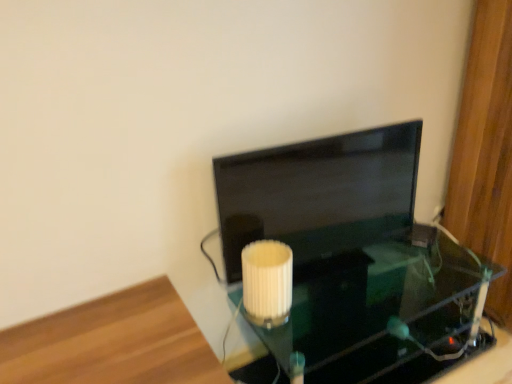
Where is `wooden floor at lower left`? Image resolution: width=512 pixels, height=384 pixels. wooden floor at lower left is located at coordinates (113, 342).

You are a GUI agent. You are given a task and a screenshot of the screen. Output one action in this format:
    pyautogui.click(x=<x>, y=<y>)
    Task: Click on the transparent glass table at center
    Image resolution: width=512 pixels, height=384 pixels.
    Given the screenshot: What is the action you would take?
    pyautogui.click(x=377, y=315)

Between white ribbed lampshade at center and matte black monitor at center, which one appears on the right side from the viewer's perspective?

From the viewer's perspective, matte black monitor at center appears more on the right side.

From the image's perspective, which is above, white ribbed lampshade at center or matte black monitor at center?

matte black monitor at center is shown above in the image.

In the image, there is a white ribbed lampshade at center. Where is `computer monitor above it (from the image's perspective)`? The image size is (512, 384). computer monitor above it (from the image's perspective) is located at coordinates (319, 193).

Could you tell me if white ribbed lampshade at center is turned towards matte black monitor at center?

No.

Between transparent glass table at center and matte black monitor at center, which one appears on the right side from the viewer's perspective?

From the viewer's perspective, transparent glass table at center appears more on the right side.

Which of these two, transparent glass table at center or matte black monitor at center, is bigger?

With larger size is transparent glass table at center.

From their relative heights in the image, would you say transparent glass table at center is taller or shorter than matte black monitor at center?

In the image, transparent glass table at center appears to be shorter than matte black monitor at center.

Is transparent glass table at center behind matte black monitor at center?

That is False.

Considering the sizes of objects matte black monitor at center and transparent glass table at center in the image provided, who is shorter, matte black monitor at center or transparent glass table at center?

transparent glass table at center is shorter.

Based on the photo, considering the relative positions of matte black monitor at center and transparent glass table at center in the image provided, is matte black monitor at center behind transparent glass table at center?

Yes, the depth of matte black monitor at center is greater than that of transparent glass table at center.

Is matte black monitor at center oriented away from transparent glass table at center?

No.

Considering the sizes of objects matte black monitor at center and transparent glass table at center in the image provided, who is wider, matte black monitor at center or transparent glass table at center?

Wider between the two is transparent glass table at center.

Is white ribbed lampshade at center surrounding wooden floor at lower left?

Actually, wooden floor at lower left is outside white ribbed lampshade at center.

From the image's perspective, which is above, white ribbed lampshade at center or wooden floor at lower left?

white ribbed lampshade at center is shown above in the image.

Is white ribbed lampshade at center thinner than wooden floor at lower left?

Yes, white ribbed lampshade at center is thinner than wooden floor at lower left.

Based on their sizes in the image, would you say transparent glass table at center is bigger or smaller than white ribbed lampshade at center?

transparent glass table at center is bigger than white ribbed lampshade at center.

Does transparent glass table at center come behind white ribbed lampshade at center?

No, the depth of transparent glass table at center is less than that of white ribbed lampshade at center.

The image size is (512, 384). I want to click on table below the white ribbed lampshade at center (from the image's perspective), so click(377, 315).

Which is less distant, (358,306) or (268,297)?

Point (358,306) appears to be farther away from the viewer than point (268,297).

How much distance is there between wooden floor at lower left and white ribbed lampshade at center?

wooden floor at lower left and white ribbed lampshade at center are 13.83 inches apart.

Based on their sizes in the image, would you say wooden floor at lower left is bigger or smaller than white ribbed lampshade at center?

In the image, wooden floor at lower left appears to be larger than white ribbed lampshade at center.

Could you tell me if wooden floor at lower left is turned towards white ribbed lampshade at center?

No, wooden floor at lower left is not oriented towards white ribbed lampshade at center.

Between wooden floor at lower left and white ribbed lampshade at center, which one appears on the left side from the viewer's perspective?

From the viewer's perspective, wooden floor at lower left appears more on the left side.

Visually, is wooden floor at lower left positioned to the left or to the right of matte black monitor at center?

Based on their positions, wooden floor at lower left is located to the left of matte black monitor at center.

Is matte black monitor at center a part of wooden floor at lower left?

No.

Can you tell me how much wooden floor at lower left and matte black monitor at center differ in facing direction?

The facing directions of wooden floor at lower left and matte black monitor at center are 9.51 degrees apart.

This screenshot has height=384, width=512. Identify the location of furniture below the matte black monitor at center (from a real-world perspective). (113, 342).

You are a GUI agent. You are given a task and a screenshot of the screen. Output one action in this format:
    pyautogui.click(x=<x>, y=<y>)
    Task: Click on the lamp directly beneath the matte black monitor at center (from a real-world perspective)
    The image size is (512, 384).
    Given the screenshot: What is the action you would take?
    pyautogui.click(x=267, y=282)

Locate an element on the screen. table in front of the matte black monitor at center is located at coordinates (377, 315).

Based on their spatial positions, is transparent glass table at center or matte black monitor at center further from white ribbed lampshade at center?

transparent glass table at center.

Considering their positions, is matte black monitor at center positioned further to transparent glass table at center than wooden floor at lower left?

Among the two, wooden floor at lower left is located further to transparent glass table at center.

Estimate the real-world distances between objects in this image. Which object is further from matte black monitor at center, white ribbed lampshade at center or wooden floor at lower left?

wooden floor at lower left.

When comparing their distances from wooden floor at lower left, does white ribbed lampshade at center or transparent glass table at center seem further?

Based on the image, transparent glass table at center appears to be further to wooden floor at lower left.

Considering their positions, is transparent glass table at center positioned further to wooden floor at lower left than white ribbed lampshade at center?

transparent glass table at center.

Looking at the image, which one is located closer to matte black monitor at center, wooden floor at lower left or white ribbed lampshade at center?

Among the two, white ribbed lampshade at center is located nearer to matte black monitor at center.

Considering their positions, is wooden floor at lower left positioned further to transparent glass table at center than white ribbed lampshade at center?

wooden floor at lower left is positioned further to the anchor transparent glass table at center.

Estimate the real-world distances between objects in this image. Which object is further from matte black monitor at center, wooden floor at lower left or transparent glass table at center?

Among the two, wooden floor at lower left is located further to matte black monitor at center.

Identify the location of lamp between matte black monitor at center and transparent glass table at center vertically. The image size is (512, 384). (267, 282).

What are the coordinates of `lamp between wooden floor at lower left and matte black monitor at center from left to right` in the screenshot? It's located at (267, 282).

At what (x,y) coordinates should I click in order to perform the action: click on lamp between wooden floor at lower left and transparent glass table at center. Please return your answer as a coordinate pair (x, y). Image resolution: width=512 pixels, height=384 pixels. Looking at the image, I should click on (267, 282).

This screenshot has width=512, height=384. I want to click on computer monitor between wooden floor at lower left and transparent glass table at center in the horizontal direction, so click(x=319, y=193).